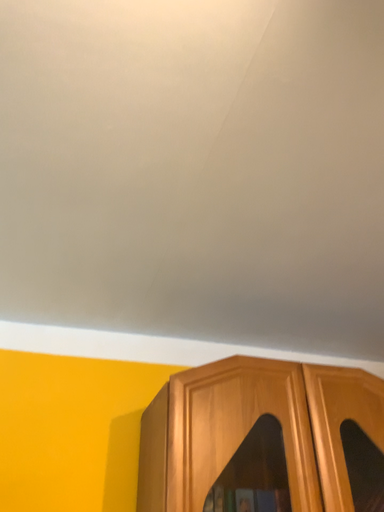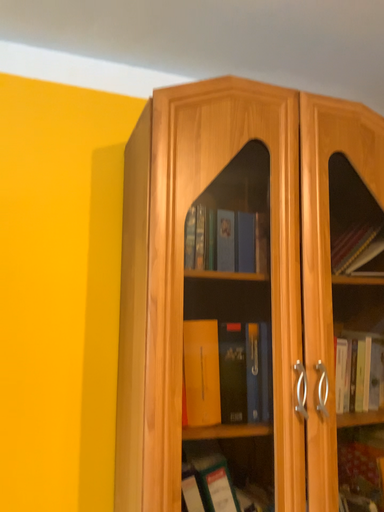
Question: Which way did the camera rotate in the video?

Choices:
 (A) rotated upward
 (B) rotated downward

Answer: (B)